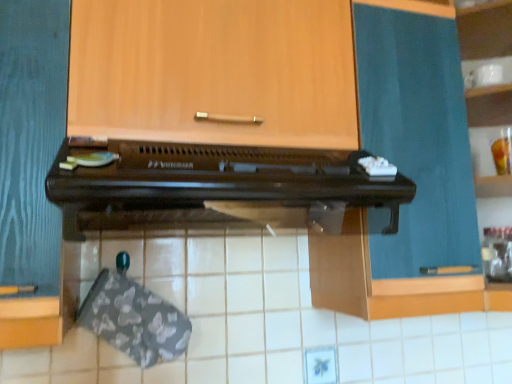
Question: Does brown wooden oven at center appear on the right side of wooden cabinet at upper center, which is the first cabinetry from left to right?

Choices:
 (A) no
 (B) yes

Answer: (B)

Question: Considering the relative sizes of brown wooden oven at center and wooden cabinet at upper center, which is the first cabinetry from left to right, in the image provided, is brown wooden oven at center thinner than wooden cabinet at upper center, which is the first cabinetry from left to right,?

Choices:
 (A) yes
 (B) no

Answer: (B)

Question: Does brown wooden oven at center come in front of wooden cabinet at upper center, the 2th cabinetry positioned from the right?

Choices:
 (A) no
 (B) yes

Answer: (B)

Question: From the image's perspective, would you say brown wooden oven at center is positioned over wooden cabinet at upper center, the 2th cabinetry positioned from the right?

Choices:
 (A) no
 (B) yes

Answer: (A)

Question: Can you confirm if brown wooden oven at center is wider than wooden cabinet at upper center, which is the first cabinetry from left to right?

Choices:
 (A) yes
 (B) no

Answer: (A)

Question: Is brown wooden oven at center at the left side of wooden cabinet at upper center, which is the first cabinetry from left to right?

Choices:
 (A) no
 (B) yes

Answer: (A)

Question: Is teal fabric curtain at upper right, placed as the 1th cabinetry when sorted from right to left, facing towards wooden cabinet at upper center, which is the first cabinetry from left to right?

Choices:
 (A) no
 (B) yes

Answer: (A)

Question: Can you confirm if teal fabric curtain at upper right, the 2th cabinetry positioned from the left, is smaller than wooden cabinet at upper center, the 2th cabinetry positioned from the right?

Choices:
 (A) no
 (B) yes

Answer: (B)

Question: Considering the relative positions of teal fabric curtain at upper right, the 2th cabinetry positioned from the left, and wooden cabinet at upper center, which is the first cabinetry from left to right, in the image provided, is teal fabric curtain at upper right, the 2th cabinetry positioned from the left, to the right of wooden cabinet at upper center, which is the first cabinetry from left to right, from the viewer's perspective?

Choices:
 (A) yes
 (B) no

Answer: (A)

Question: Is teal fabric curtain at upper right, placed as the 1th cabinetry when sorted from right to left, further to the viewer compared to wooden cabinet at upper center, which is the first cabinetry from left to right?

Choices:
 (A) no
 (B) yes

Answer: (B)

Question: From the image's perspective, is teal fabric curtain at upper right, the 2th cabinetry positioned from the left, beneath wooden cabinet at upper center, the 2th cabinetry positioned from the right?

Choices:
 (A) yes
 (B) no

Answer: (A)

Question: From the image's perspective, is teal fabric curtain at upper right, the 2th cabinetry positioned from the left, on wooden cabinet at upper center, the 2th cabinetry positioned from the right?

Choices:
 (A) yes
 (B) no

Answer: (B)

Question: Does brown wooden oven at center have a greater width compared to white glossy cup at upper right?

Choices:
 (A) no
 (B) yes

Answer: (B)